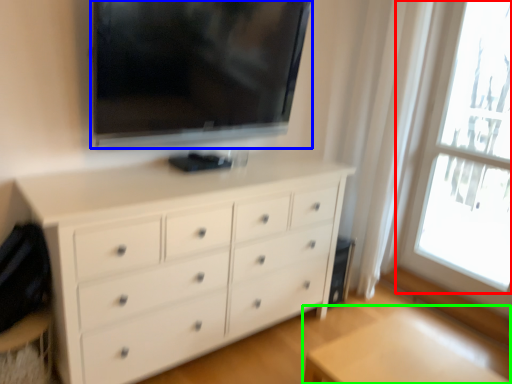
Question: Which object is positioned farthest from window (highlighted by a red box)? Select from television (highlighted by a blue box) and table (highlighted by a green box).

Choices:
 (A) television
 (B) table

Answer: (B)